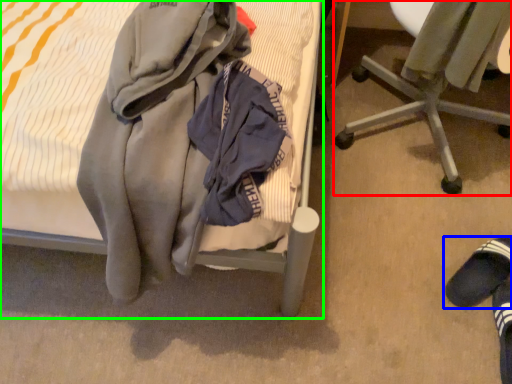
Question: Which object is the closest to the chair (highlighted by a red box)? Choose among these: footwear (highlighted by a blue box) or bed (highlighted by a green box).

Choices:
 (A) footwear
 (B) bed

Answer: (A)